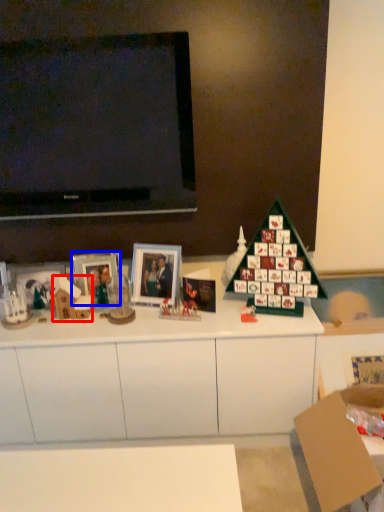
Question: Which of the following is the closest to the observer, toy (highlighted by a red box) or picture frame (highlighted by a blue box)?

Choices:
 (A) toy
 (B) picture frame

Answer: (A)